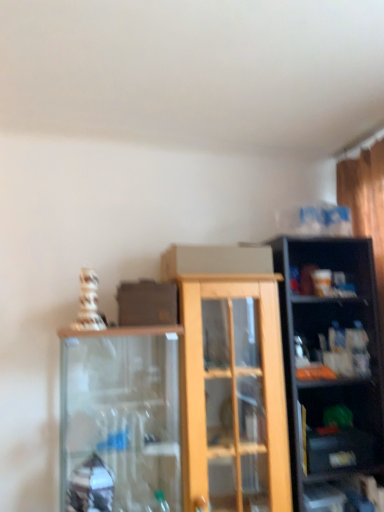
Question: Visually, is matte black shelf at lower right, which is the 1th shelf in bottom-to-top order, positioned to the left or to the right of clear plastic bottles at right, which is counted as the second shelf, starting from the bottom?

Choices:
 (A) left
 (B) right

Answer: (A)

Question: From the image's perspective, is matte black shelf at lower right, the 2th shelf viewed from the top, above or below clear plastic bottles at right, placed as the 1th shelf when sorted from top to bottom?

Choices:
 (A) below
 (B) above

Answer: (A)

Question: Is matte black shelf at lower right, which is the 1th shelf in bottom-to-top order, bigger or smaller than clear plastic bottles at right, which is counted as the second shelf, starting from the bottom?

Choices:
 (A) big
 (B) small

Answer: (B)

Question: Is point (342, 335) closer or farther from the camera than point (339, 455)?

Choices:
 (A) farther
 (B) closer

Answer: (A)

Question: In terms of width, does clear plastic bottles at right, which is counted as the second shelf, starting from the bottom, look wider or thinner when compared to matte black shelf at lower right, the 2th shelf viewed from the top?

Choices:
 (A) wide
 (B) thin

Answer: (A)

Question: In the image, is clear plastic bottles at right, placed as the 1th shelf when sorted from top to bottom, positioned in front of or behind matte black shelf at lower right, the 2th shelf viewed from the top?

Choices:
 (A) front
 (B) behind

Answer: (B)

Question: Is clear plastic bottles at right, placed as the 1th shelf when sorted from top to bottom, inside or outside of matte black shelf at lower right, the 2th shelf viewed from the top?

Choices:
 (A) outside
 (B) inside

Answer: (A)